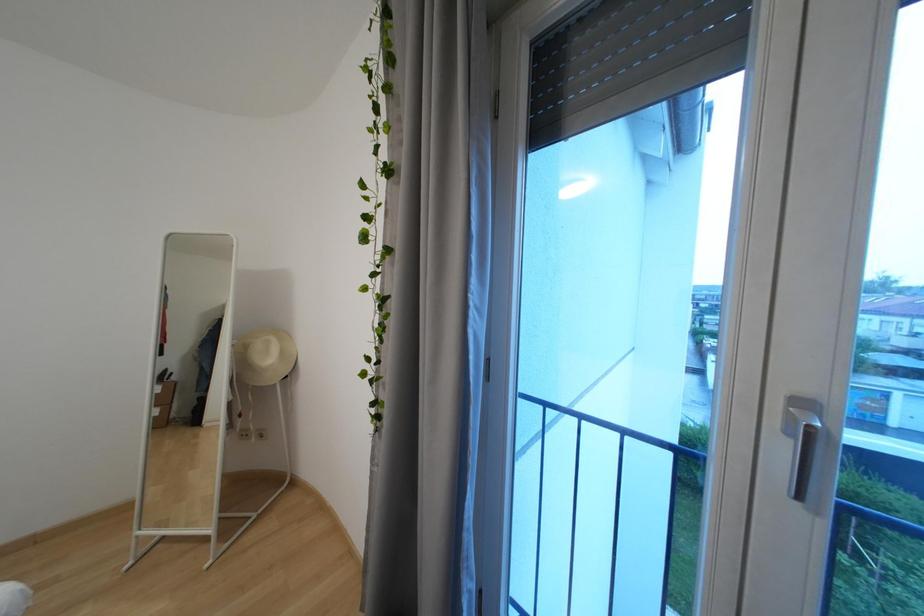
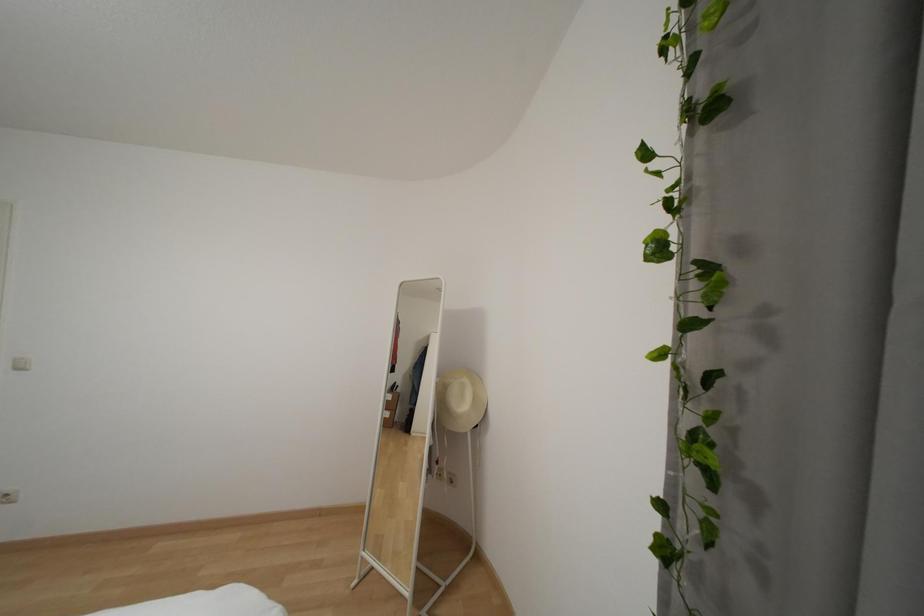
Question: The images are taken continuously from a first-person perspective. In which direction is your viewpoint rotating?

Choices:
 (A) Left
 (B) Right
 (C) Up
 (D) Down

Answer: (A)